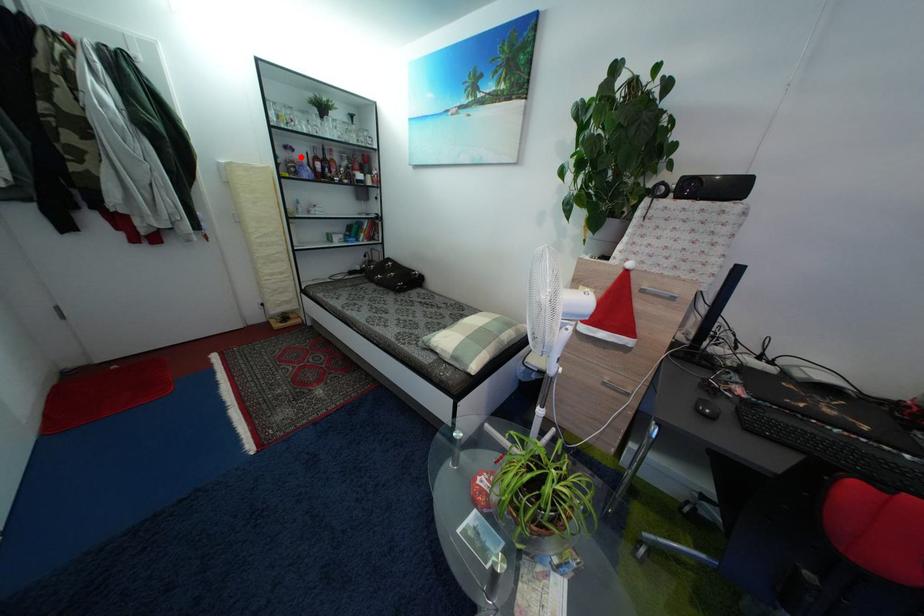
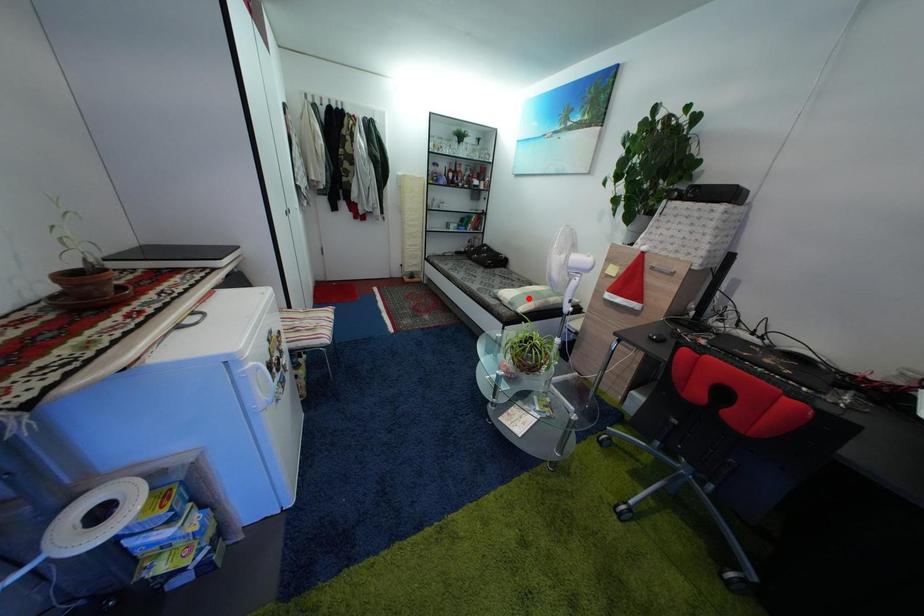
I am providing you with two images of the same scene from different viewpoints. A red point is marked on the first image and another point is marked on the second image. Does the point marked in image1 correspond to the same location as the one in image2?

No